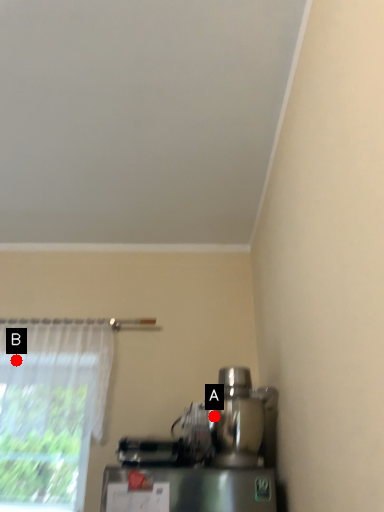
Question: Two points are circled on the image, labeled by A and B beside each circle. Which point appears farthest from the camera in this image?

Choices:
 (A) A is further
 (B) B is further

Answer: (B)